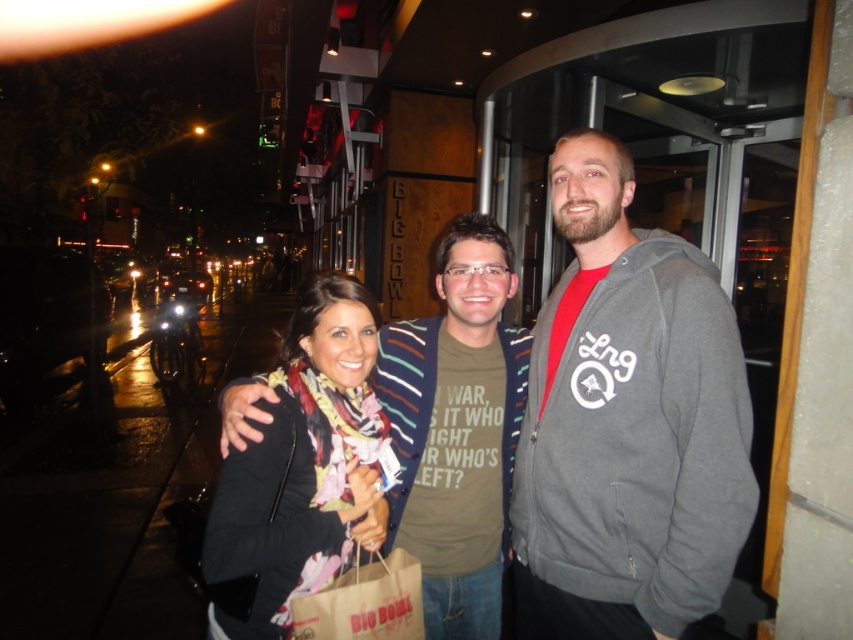
You are a photographer trying to capture the gray fleece hoodie at right in your shot. The camera focuses on the point at coordinates point [627,422]. Is this point on the gray fleece hoodie at right?

Yes, the point [627,422] is on the gray fleece hoodie at right, so the camera will focus on it.

You are standing in the scene and want to hand a small item to the person wearing the gray fleece hoodie at right without moving closer. Can you do this from your current position?

The gray fleece hoodie at right and viewer are 4.69 feet apart, so yes, you can hand the small item to the person wearing the gray fleece hoodie at right from your current position since the distance is manageable.

You are a photographer trying to capture the gray fleece hoodie at right in the nighttime urban scene. The camera is set to focus on the point at coordinates (627, 422). Will the gray fleece hoodie at right be in focus?

The point at coordinates (627, 422) indicates the gray fleece hoodie at right, so yes, the gray fleece hoodie at right will be in focus.